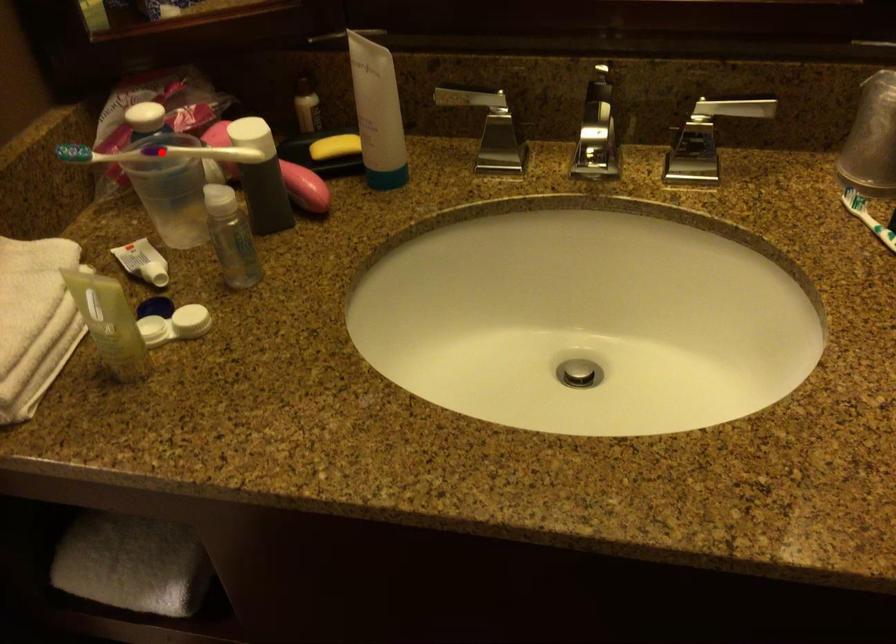
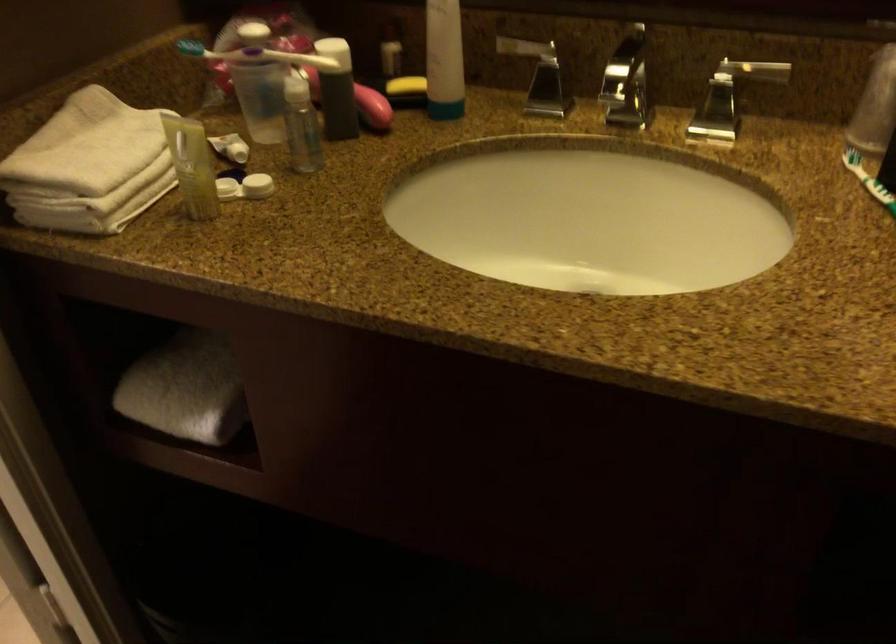
Question: I am providing you with two images of the same scene from different viewpoints. A red point is shown in image1. For the corresponding object point in image2, is it positioned nearer or farther from the camera?

Choices:
 (A) Nearer
 (B) Farther

Answer: (B)